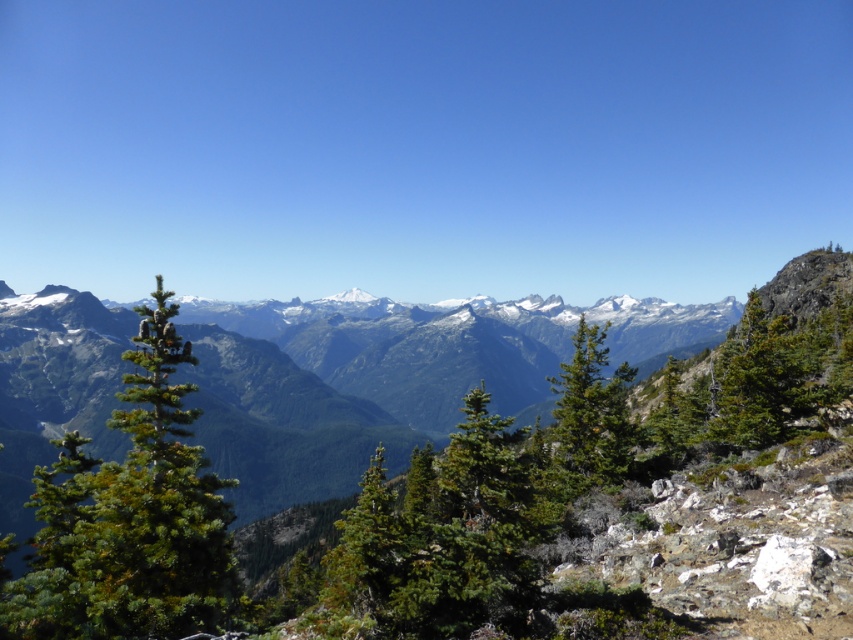
What do you see at coordinates (351, 401) in the screenshot?
I see `green textured pine trees at center` at bounding box center [351, 401].

Can you confirm if green textured pine trees at center is bigger than green textured pine tree at center?

Indeed, green textured pine trees at center has a larger size compared to green textured pine tree at center.

Which is in front, point (305, 401) or point (572, 378)?

Point (572, 378) is in front.

Locate an element on the screen. green textured pine trees at center is located at coordinates (351, 401).

In the scene shown: Is green textured pine trees at center thinner than green needle-like at left?

No.

The height and width of the screenshot is (640, 853). What do you see at coordinates (351, 401) in the screenshot? I see `green textured pine trees at center` at bounding box center [351, 401].

Does point (321, 497) come closer to viewer compared to point (83, 620)?

No, it is behind (83, 620).

Locate an element on the screen. Image resolution: width=853 pixels, height=640 pixels. green textured pine trees at center is located at coordinates (351, 401).

Consider the image. Can you confirm if green needle-like at left is positioned to the left of green textured pine tree at center?

Yes, green needle-like at left is to the left of green textured pine tree at center.

Is green needle-like at left in front of green textured pine tree at center?

Yes, it is in front of green textured pine tree at center.

Does point (57, 595) lie behind point (605, 440)?

No, it is in front of (605, 440).

This screenshot has width=853, height=640. Identify the location of green needle-like at left. (131, 516).